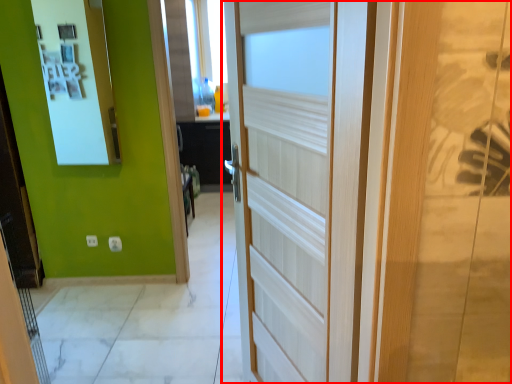
Question: In this image, where is door (annotated by the red box) located relative to medicine cabinet?

Choices:
 (A) right
 (B) left

Answer: (A)